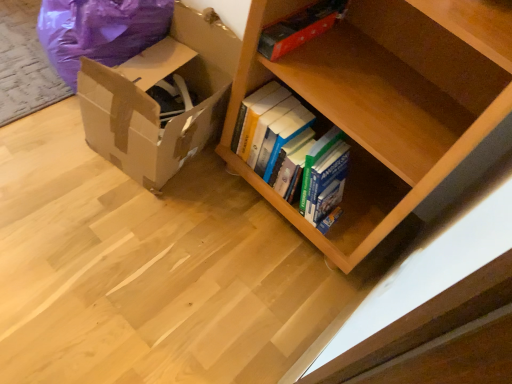
Question: Would you say purple plastic bean bag chair at left is part of red matte book at upper center's contents?

Choices:
 (A) yes
 (B) no

Answer: (B)

Question: From the image's perspective, is red matte book at upper center under purple plastic bean bag chair at left?

Choices:
 (A) no
 (B) yes

Answer: (B)

Question: Is red matte book at upper center outside purple plastic bean bag chair at left?

Choices:
 (A) yes
 (B) no

Answer: (A)

Question: Does red matte book at upper center lie behind purple plastic bean bag chair at left?

Choices:
 (A) yes
 (B) no

Answer: (B)

Question: Is red matte book at upper center taller than purple plastic bean bag chair at left?

Choices:
 (A) no
 (B) yes

Answer: (A)

Question: Considering the positions of red matte book at upper center and purple plastic bean bag chair at left in the image, is red matte book at upper center taller or shorter than purple plastic bean bag chair at left?

Choices:
 (A) short
 (B) tall

Answer: (A)

Question: From the image's perspective, is red matte book at upper center located above or below purple plastic bean bag chair at left?

Choices:
 (A) above
 (B) below

Answer: (B)

Question: Looking at their shapes, would you say red matte book at upper center is wider or thinner than purple plastic bean bag chair at left?

Choices:
 (A) wide
 (B) thin

Answer: (B)

Question: Is point (306, 14) positioned closer to the camera than point (76, 44)?

Choices:
 (A) farther
 (B) closer

Answer: (B)

Question: In terms of width, does purple plastic bean bag chair at left look wider or thinner when compared to brown cardboard box at lower left?

Choices:
 (A) wide
 (B) thin

Answer: (B)

Question: Is point (77, 49) closer or farther from the camera than point (232, 34)?

Choices:
 (A) closer
 (B) farther

Answer: (A)

Question: Is purple plastic bean bag chair at left inside or outside of brown cardboard box at lower left?

Choices:
 (A) outside
 (B) inside

Answer: (A)

Question: From the image's perspective, is purple plastic bean bag chair at left located above or below brown cardboard box at lower left?

Choices:
 (A) below
 (B) above

Answer: (B)

Question: From the image's perspective, relative to red matte book at upper center, is purple plastic bean bag chair at left above or below?

Choices:
 (A) above
 (B) below

Answer: (A)

Question: In terms of width, does purple plastic bean bag chair at left look wider or thinner when compared to red matte book at upper center?

Choices:
 (A) wide
 (B) thin

Answer: (A)